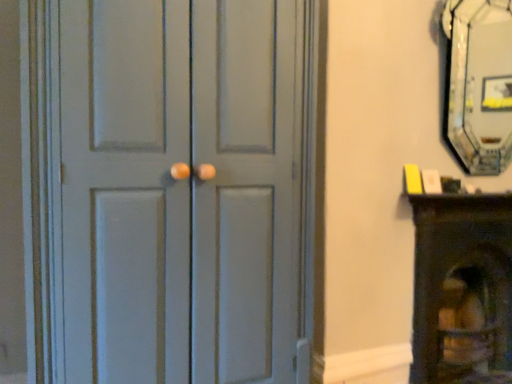
Question: Does wooden fireplace at right appear on the left side of black glass fireplace at upper right?

Choices:
 (A) no
 (B) yes

Answer: (A)

Question: From the image's perspective, is wooden fireplace at right located above black glass fireplace at upper right?

Choices:
 (A) no
 (B) yes

Answer: (A)

Question: Considering the relative sizes of wooden fireplace at right and black glass fireplace at upper right in the image provided, is wooden fireplace at right shorter than black glass fireplace at upper right?

Choices:
 (A) yes
 (B) no

Answer: (B)

Question: From a real-world perspective, does wooden fireplace at right sit lower than black glass fireplace at upper right?

Choices:
 (A) yes
 (B) no

Answer: (A)

Question: Does wooden fireplace at right have a greater width compared to black glass fireplace at upper right?

Choices:
 (A) no
 (B) yes

Answer: (B)

Question: Are wooden fireplace at right and black glass fireplace at upper right far apart?

Choices:
 (A) yes
 (B) no

Answer: (A)

Question: From the image's perspective, is black glass fireplace at upper right below wooden fireplace at right?

Choices:
 (A) yes
 (B) no

Answer: (B)

Question: From a real-world perspective, is black glass fireplace at upper right physically above wooden fireplace at right?

Choices:
 (A) no
 (B) yes

Answer: (B)

Question: Could you tell me if black glass fireplace at upper right is facing wooden fireplace at right?

Choices:
 (A) yes
 (B) no

Answer: (B)

Question: Does black glass fireplace at upper right have a lesser width compared to wooden fireplace at right?

Choices:
 (A) no
 (B) yes

Answer: (B)

Question: Is black glass fireplace at upper right further to the viewer compared to wooden fireplace at right?

Choices:
 (A) yes
 (B) no

Answer: (B)

Question: Can you confirm if black glass fireplace at upper right is positioned to the right of wooden fireplace at right?

Choices:
 (A) no
 (B) yes

Answer: (A)

Question: Is the depth of matte gray door at center less than that of wooden fireplace at right?

Choices:
 (A) yes
 (B) no

Answer: (A)